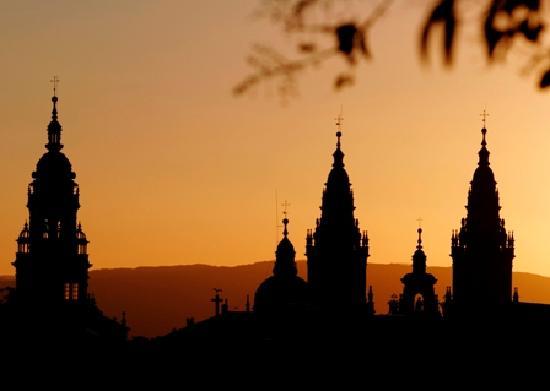
Identify the location of window. Image resolution: width=550 pixels, height=391 pixels. (416, 301).